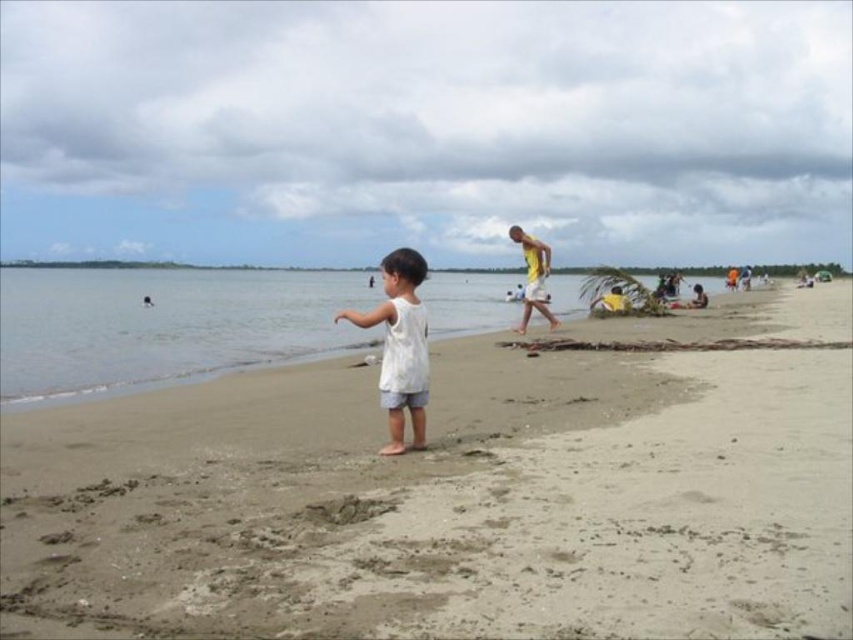
Question: Does clear water at lower left come in front of white cotton shirt at center?

Choices:
 (A) no
 (B) yes

Answer: (A)

Question: Which of the following is the farthest from the observer?

Choices:
 (A) (473, 538)
 (B) (524, 305)
 (C) (9, 396)

Answer: (B)

Question: Estimate the real-world distances between objects in this image. Which object is farther from the white cotton shirt at center?

Choices:
 (A) light brown sand at center
 (B) yellow fabric shirt at center-right

Answer: (B)

Question: Does light brown sand at center lie behind yellow fabric shirt at center-right?

Choices:
 (A) no
 (B) yes

Answer: (A)

Question: Does clear water at lower left have a smaller size compared to yellow fabric shirt at center-right?

Choices:
 (A) yes
 (B) no

Answer: (B)

Question: Which object is positioned closest to the white cotton shirt at center?

Choices:
 (A) light brown sand at center
 (B) yellow fabric shirt at center-right
 (C) clear water at lower left

Answer: (A)